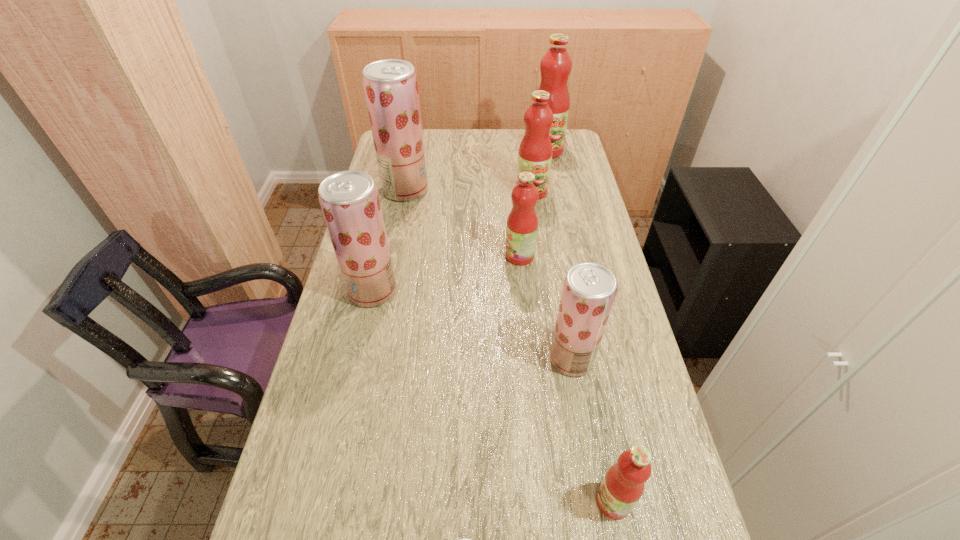
Where is `the nearest pink fruit juice`? the nearest pink fruit juice is located at coordinates (623, 485).

This screenshot has height=540, width=960. In order to click on the seventh farthest object in this screenshot , I will do `click(623, 485)`.

This screenshot has width=960, height=540. I want to click on vacant space located on the right of the farthest strawberry fruit juice, so click(463, 190).

Where is `vacant area located on the front label of the biggest pink fruit juice`? The height and width of the screenshot is (540, 960). vacant area located on the front label of the biggest pink fruit juice is located at coordinates (549, 166).

Locate an element on the screen. Image resolution: width=960 pixels, height=540 pixels. vacant space located on the front label of the second farthest pink fruit juice is located at coordinates (535, 211).

This screenshot has height=540, width=960. Identify the location of free space located on the right of the fifth farthest object. [x=430, y=291].

The width and height of the screenshot is (960, 540). Find the location of `vacant space located on the back of the second nearest strawberry fruit juice`. vacant space located on the back of the second nearest strawberry fruit juice is located at coordinates (552, 245).

You are a GUI agent. You are given a task and a screenshot of the screen. Output one action in this format:
    pyautogui.click(x=<x>, y=<y>)
    Task: Click on the vacant space positioned 0.220m on the front label of the fourth farthest fruit juice
    The height and width of the screenshot is (540, 960).
    Given the screenshot: What is the action you would take?
    pyautogui.click(x=437, y=256)

You are a GUI agent. You are given a task and a screenshot of the screen. Output one action in this format:
    pyautogui.click(x=<x>, y=<y>)
    Task: Click on the vacant region located on the front label of the fourth farthest fruit juice
    This screenshot has height=540, width=960.
    Given the screenshot: What is the action you would take?
    pyautogui.click(x=480, y=256)

Identify the location of free space located 0.380m on the front label of the fourth farthest fruit juice. click(x=387, y=256).